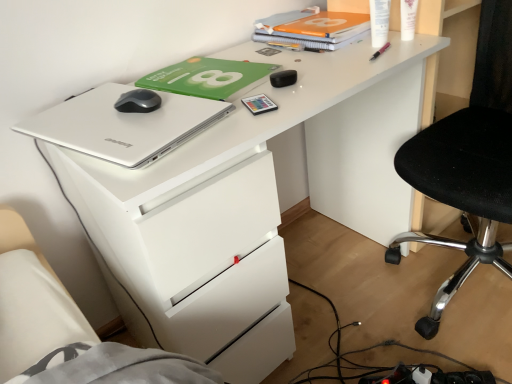
The height and width of the screenshot is (384, 512). I want to click on vacant space that is to the left of white glossy lotion at upper right, the first stationery when ordered from right to left, so click(x=344, y=50).